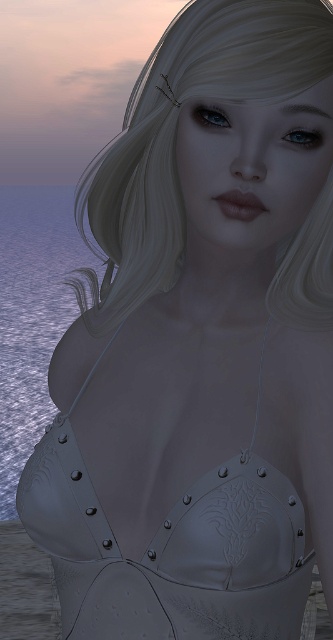
Question: Considering the relative positions of blonde hair at upper center and blue water at left in the image provided, where is blonde hair at upper center located with respect to blue water at left?

Choices:
 (A) below
 (B) above

Answer: (A)

Question: Which object appears farthest from the camera in this image?

Choices:
 (A) blue water at left
 (B) silver metallic corset at center

Answer: (A)

Question: Among these points, which one is farthest from the camera?

Choices:
 (A) (20, 432)
 (B) (171, 198)

Answer: (A)

Question: In this image, where is silver metallic corset at center located relative to blue water at left?

Choices:
 (A) left
 (B) right

Answer: (B)

Question: Considering the relative positions of blonde hair at upper center and blue water at left in the image provided, where is blonde hair at upper center located with respect to blue water at left?

Choices:
 (A) below
 (B) above

Answer: (A)

Question: Among these points, which one is farthest from the camera?

Choices:
 (A) (38, 266)
 (B) (77, 452)

Answer: (A)